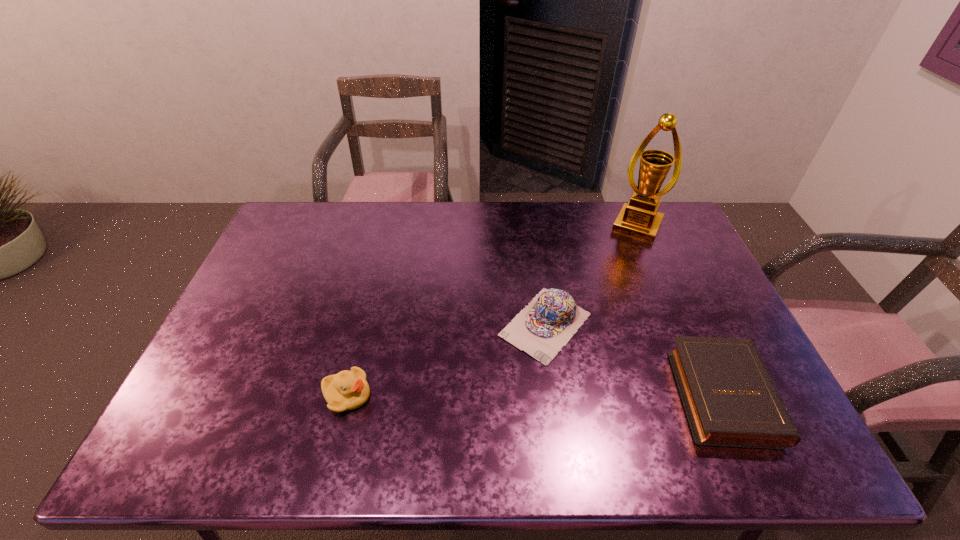
Locate an element on the screen. Image resolution: width=960 pixels, height=540 pixels. vacant space at the far left corner of the desktop is located at coordinates (304, 238).

I want to click on free space at the near left corner of the desktop, so click(x=199, y=418).

The width and height of the screenshot is (960, 540). In order to click on vacant space at the far right corner in this screenshot , I will do `click(673, 230)`.

At what (x,y) coordinates should I click in order to perform the action: click on free space between the third object from right to left and the tallest object. Please return your answer as a coordinate pair (x, y). This screenshot has height=540, width=960. Looking at the image, I should click on (591, 275).

The image size is (960, 540). What are the coordinates of `free space that is in between the cap and the tallest object` in the screenshot? It's located at (591, 275).

Locate an element on the screen. The image size is (960, 540). free area in between the Bible and the third object from right to left is located at coordinates (634, 359).

This screenshot has height=540, width=960. I want to click on vacant area that lies between the award and the leftmost object, so click(x=492, y=310).

This screenshot has height=540, width=960. Find the location of `vacant space in between the tallest object and the duckling`. vacant space in between the tallest object and the duckling is located at coordinates (492, 310).

I want to click on empty space that is in between the leftmost object and the Bible, so click(535, 394).

You are a GUI agent. You are given a task and a screenshot of the screen. Output one action in this format:
    pyautogui.click(x=<x>, y=<y>)
    Task: Click on the free space between the second object from left to right and the Bible
    The image size is (960, 540).
    Given the screenshot: What is the action you would take?
    pyautogui.click(x=634, y=359)